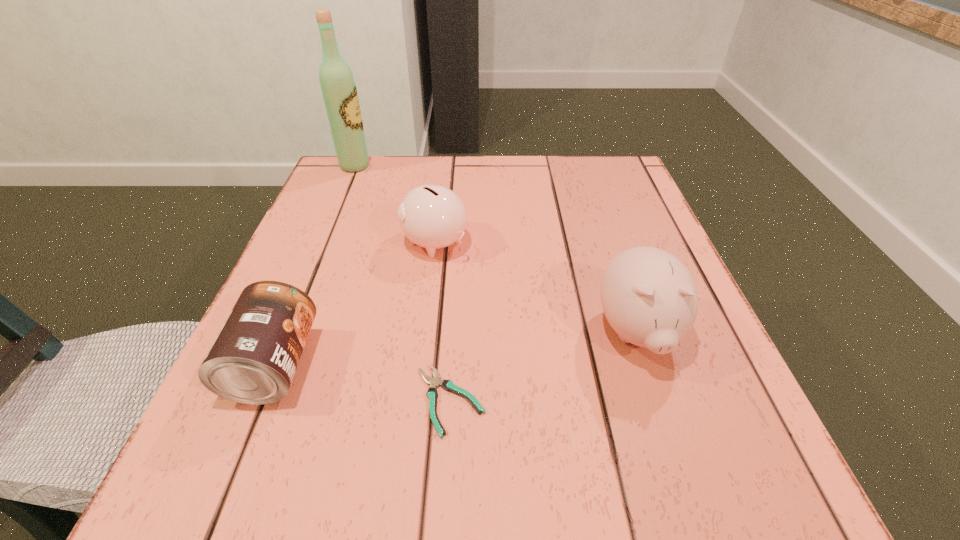
Find the location of `free space in the image that satisfies the following two spatial constraints: 1. on the front-facing side of the second farthest object; 2. on the right side of the tallest object`. free space in the image that satisfies the following two spatial constraints: 1. on the front-facing side of the second farthest object; 2. on the right side of the tallest object is located at coordinates (324, 242).

You are a GUI agent. You are given a task and a screenshot of the screen. Output one action in this format:
    pyautogui.click(x=<x>, y=<y>)
    Task: Click on the vacant region that satisfies the following two spatial constraints: 1. on the front-facing side of the shortest object; 2. on the left side of the wine bottle
    Image resolution: width=960 pixels, height=540 pixels.
    Given the screenshot: What is the action you would take?
    pyautogui.click(x=258, y=400)

What are the coordinates of `free region that satisfies the following two spatial constraints: 1. on the front-facing side of the wine bottle; 2. on the back side of the farther piggy bank` in the screenshot? It's located at (324, 242).